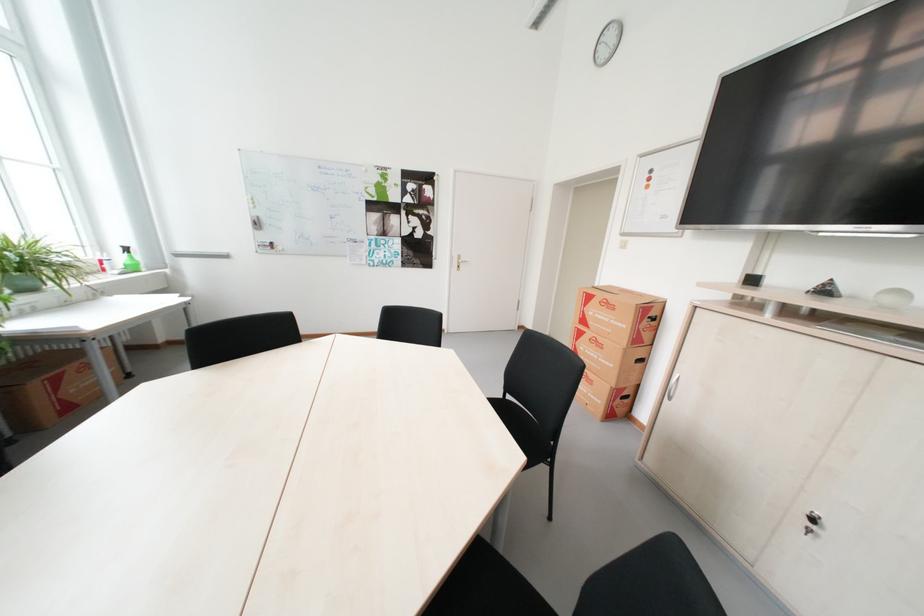
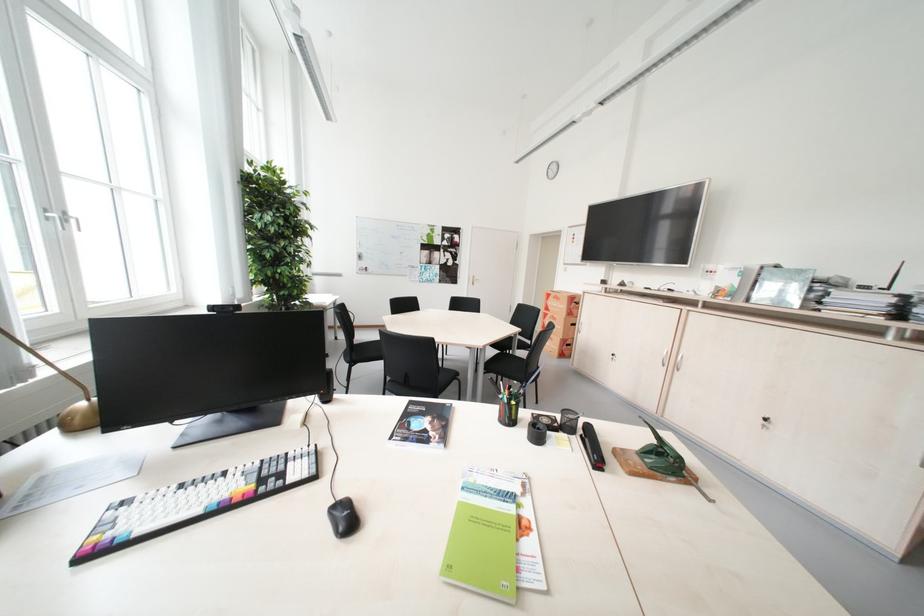
Find the pixel in the second image that matches point 452,253 in the first image.

(473, 275)